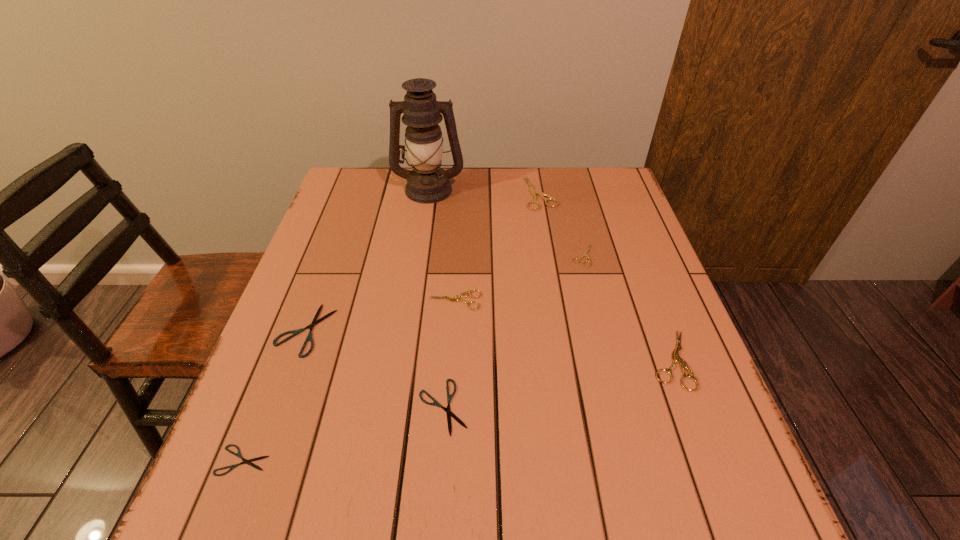
Where is `vacant area between the tallest object and the farthest shears`? Image resolution: width=960 pixels, height=540 pixels. vacant area between the tallest object and the farthest shears is located at coordinates pos(485,191).

Identify the location of empty space that is in between the rightmost beige shears and the fifth shortest shears. (564, 330).

Locate which object ranks seventh in proximity to the second farthest shears. Please provide its 2D coordinates. Your answer should be formatted as a tuple, i.e. [(x, y)], where the tuple contains the x and y coordinates of a point satisfying the conditions above.

[(249, 462)]

The height and width of the screenshot is (540, 960). I want to click on object that stands as the sixth closest to the nearest beige shears, so click(295, 332).

Where is `the fifth closest shears to the second farthest beige shears`? The height and width of the screenshot is (540, 960). the fifth closest shears to the second farthest beige shears is located at coordinates (295, 332).

Identify which shears is located as the nearest to the rightmost object. Please provide its 2D coordinates. Your answer should be formatted as a tuple, i.e. [(x, y)], where the tuple contains the x and y coordinates of a point satisfying the conditions above.

[(585, 253)]

The image size is (960, 540). Find the location of `beige shears that is the second nearest to the second smallest black shears`. beige shears that is the second nearest to the second smallest black shears is located at coordinates (676, 359).

Identify which beige shears is located as the second nearest to the second beige shears from right to left. Please provide its 2D coordinates. Your answer should be formatted as a tuple, i.e. [(x, y)], where the tuple contains the x and y coordinates of a point satisfying the conditions above.

[(676, 359)]

Identify the location of the second closest black shears relative to the farthest black shears. (449, 397).

What are the coordinates of `black shears that is the second closest one to the second nearest beige shears` in the screenshot? It's located at (295, 332).